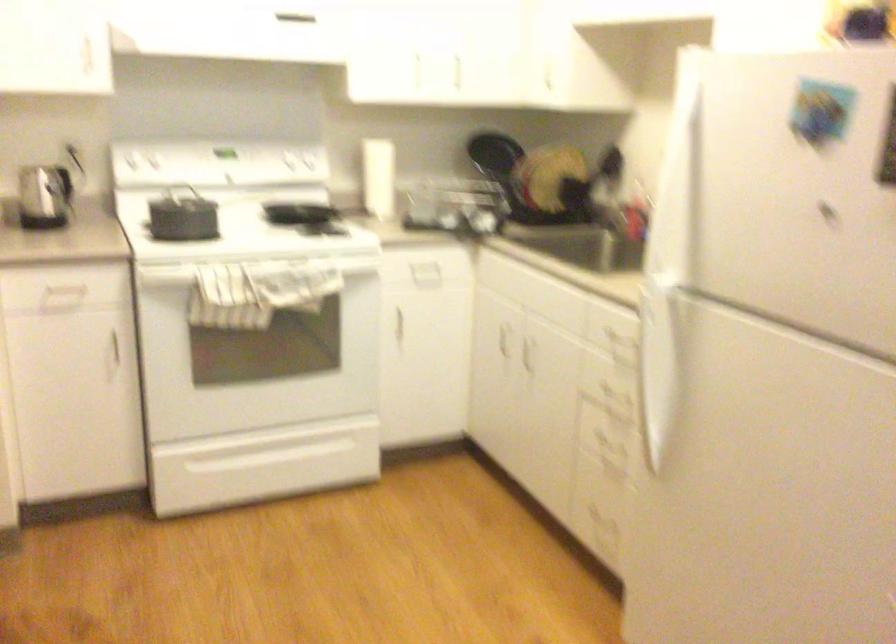
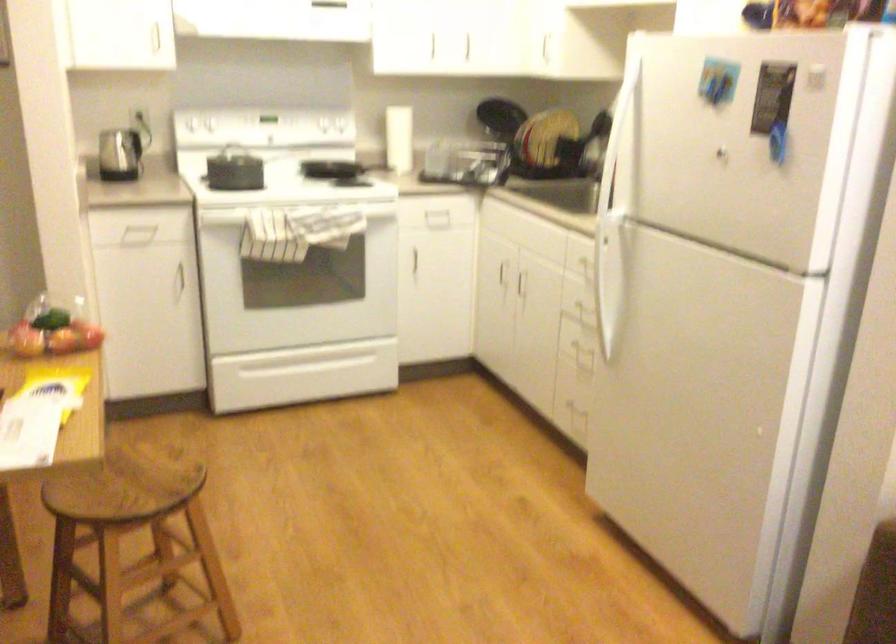
The point at (421, 346) is marked in the first image. Where is the corresponding point in the second image?

(435, 276)